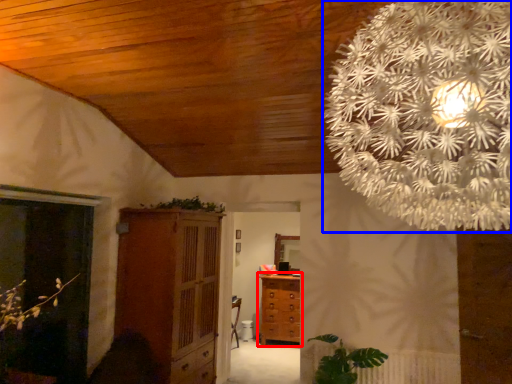
Question: Which point is closer to the camera, chest of drawers (highlighted by a red box) or flower (highlighted by a blue box)?

Choices:
 (A) chest of drawers
 (B) flower

Answer: (B)